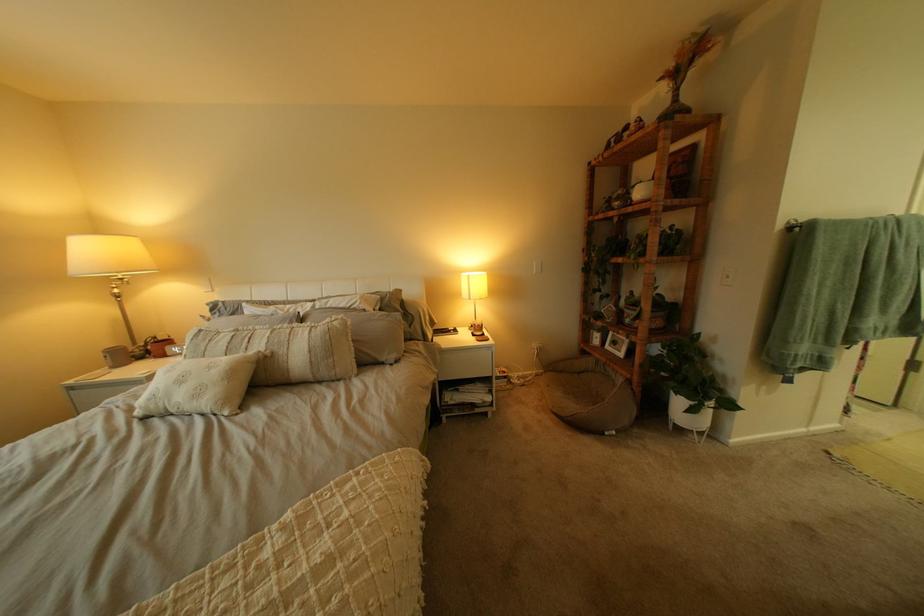
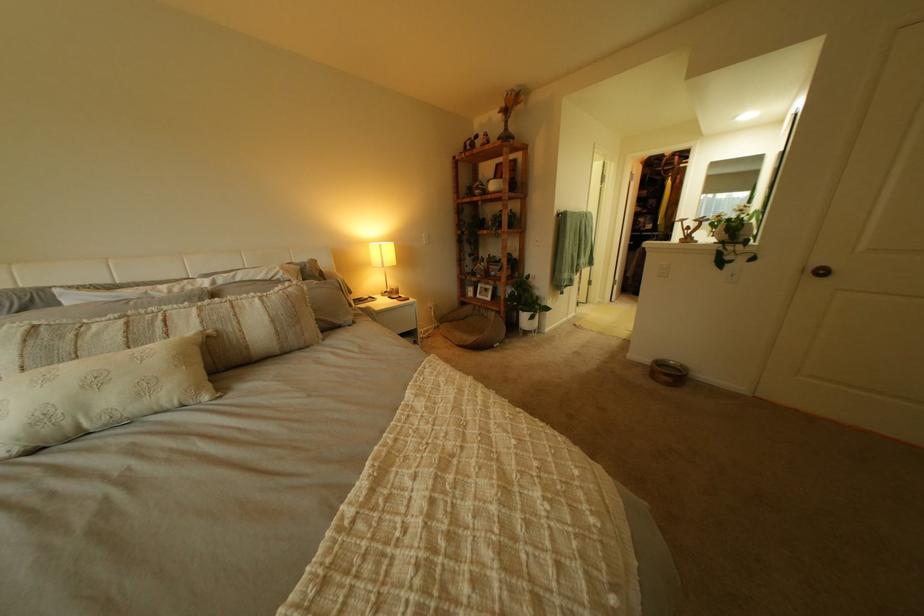
Locate, in the second image, the point that corresponds to point (281, 342) in the first image.

(213, 323)